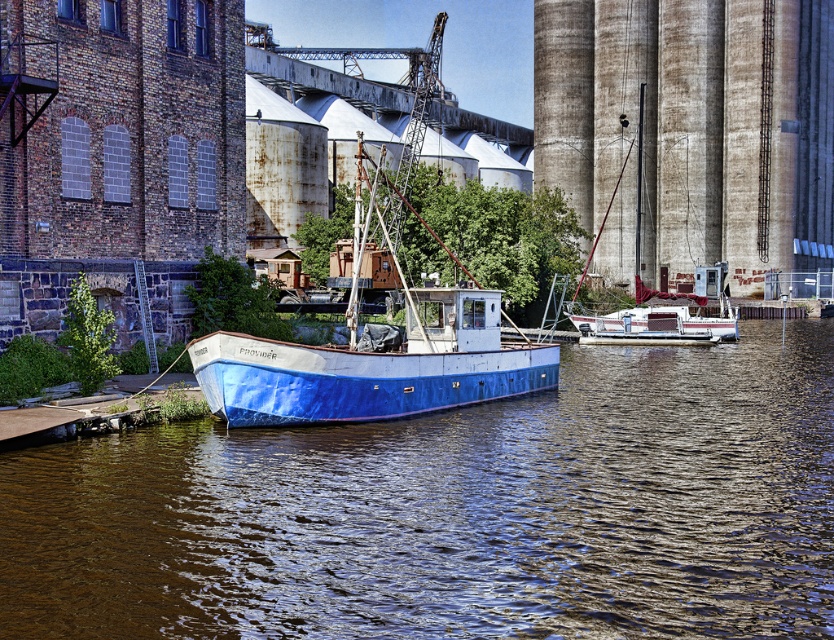
Question: Is blue matte boat at center wider than white-painted wood sailboat at center-right?

Choices:
 (A) no
 (B) yes

Answer: (A)

Question: Is brown water at center positioned before white-painted wood sailboat at center-right?

Choices:
 (A) yes
 (B) no

Answer: (A)

Question: Based on their relative distances, which object is farther from the brown water at center?

Choices:
 (A) blue matte boat at center
 (B) white-painted wood sailboat at center-right

Answer: (B)

Question: Is blue matte boat at center thinner than white-painted wood sailboat at center-right?

Choices:
 (A) no
 (B) yes

Answer: (B)

Question: Which of the following is the closest to the observer?

Choices:
 (A) (586, 326)
 (B) (734, 600)

Answer: (B)

Question: Which object is closer to the camera taking this photo?

Choices:
 (A) white-painted wood sailboat at center-right
 (B) blue matte boat at center
 (C) brown water at center

Answer: (C)